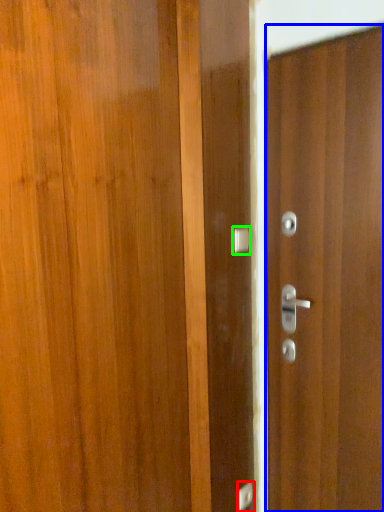
Question: Estimate the real-world distances between objects in this image. Which object is farther from door handle (highlighted by a red box), door (highlighted by a blue box) or door handle (highlighted by a green box)?

Choices:
 (A) door
 (B) door handle

Answer: (B)